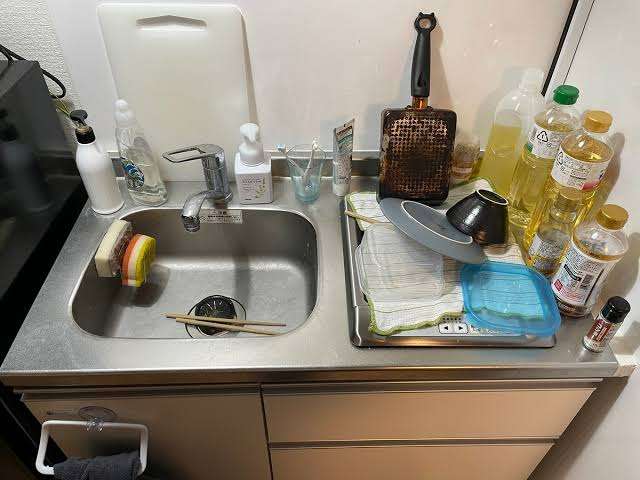
You are a GUI agent. You are given a task and a screenshot of the screen. Output one action in this format:
    pyautogui.click(x=<x>, y=<y>)
    Task: Click on the sponges
    This screenshot has height=480, width=640.
    Given the screenshot: What is the action you would take?
    pyautogui.click(x=134, y=254), pyautogui.click(x=108, y=256)